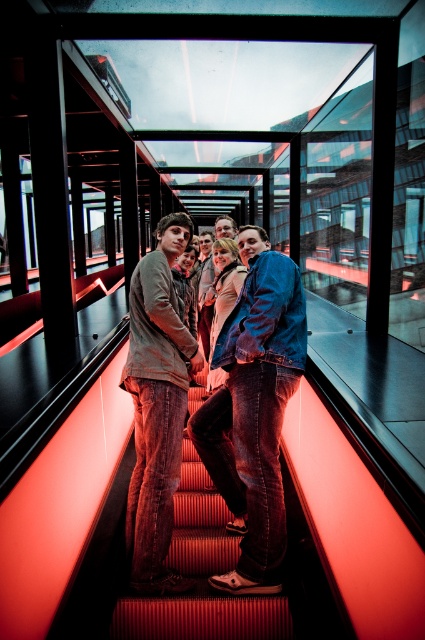
Which is above, matte gray hoodie at center or smooth red carpet at center?

matte gray hoodie at center is higher up.

Which is more to the right, matte gray hoodie at center or smooth red carpet at center?

smooth red carpet at center

Is point (178, 212) positioned before point (234, 598)?

That is False.

Where is `matte gray hoodie at center`? The width and height of the screenshot is (425, 640). matte gray hoodie at center is located at coordinates (156, 404).

Is denim jacket at center positioned in front of matte gray hoodie at center?

Yes, denim jacket at center is in front of matte gray hoodie at center.

Locate an element on the screen. This screenshot has height=640, width=425. denim jacket at center is located at coordinates (255, 408).

Looking at this image, which is more to the right, denim jacket at center or smooth red carpet at center?

Positioned to the right is denim jacket at center.

Does denim jacket at center have a greater width compared to smooth red carpet at center?

No, denim jacket at center is not wider than smooth red carpet at center.

Which is behind, point (255, 378) or point (200, 596)?

The point (200, 596) is behind.

The height and width of the screenshot is (640, 425). I want to click on denim jacket at center, so click(x=255, y=408).